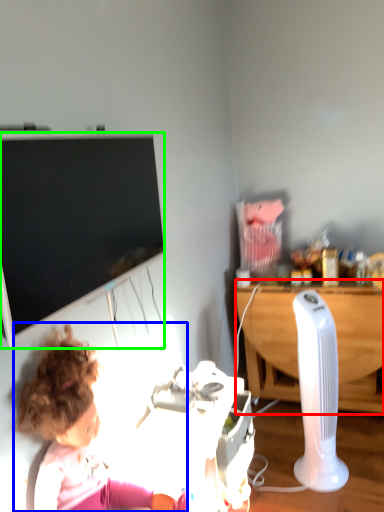
Question: Estimate the real-world distances between objects in this image. Which object is farther from desk (highlighted by a red box), person (highlighted by a blue box) or television (highlighted by a green box)?

Choices:
 (A) person
 (B) television

Answer: (A)